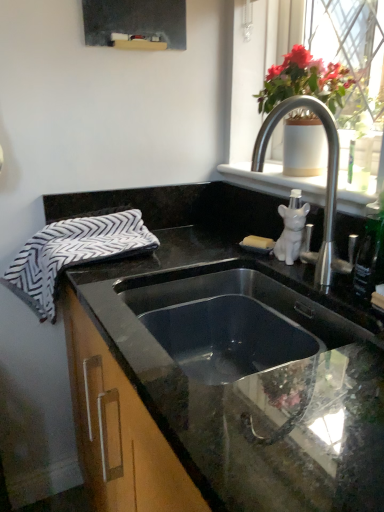
Question: Is satin nickel faucet at upper right at the left side of white ceramic dog at upper right?

Choices:
 (A) no
 (B) yes

Answer: (B)

Question: Does satin nickel faucet at upper right have a lesser width compared to white ceramic dog at upper right?

Choices:
 (A) yes
 (B) no

Answer: (B)

Question: Is satin nickel faucet at upper right wider than white ceramic dog at upper right?

Choices:
 (A) yes
 (B) no

Answer: (A)

Question: Would you say white ceramic dog at upper right is part of satin nickel faucet at upper right's contents?

Choices:
 (A) no
 (B) yes

Answer: (A)

Question: Is satin nickel faucet at upper right far from white ceramic dog at upper right?

Choices:
 (A) yes
 (B) no

Answer: (B)

Question: Is white ceramic vase at upper right to the left or to the right of white ceramic dog at upper right in the image?

Choices:
 (A) right
 (B) left

Answer: (A)

Question: In terms of height, does white ceramic vase at upper right look taller or shorter compared to white ceramic dog at upper right?

Choices:
 (A) tall
 (B) short

Answer: (A)

Question: In terms of size, does white ceramic vase at upper right appear bigger or smaller than white ceramic dog at upper right?

Choices:
 (A) big
 (B) small

Answer: (A)

Question: Which is correct: white ceramic vase at upper right is inside white ceramic dog at upper right, or outside of it?

Choices:
 (A) outside
 (B) inside

Answer: (A)

Question: Considering their positions, is black granite countertop at center located in front of or behind black and white zigzag beach towel at left?

Choices:
 (A) behind
 (B) front

Answer: (B)

Question: Considering the positions of black granite countertop at center and black and white zigzag beach towel at left in the image, is black granite countertop at center wider or thinner than black and white zigzag beach towel at left?

Choices:
 (A) thin
 (B) wide

Answer: (B)

Question: Does point (327, 389) appear closer or farther from the camera than point (107, 245)?

Choices:
 (A) farther
 (B) closer

Answer: (B)

Question: Would you say black granite countertop at center is to the left or to the right of black and white zigzag beach towel at left in the picture?

Choices:
 (A) left
 (B) right

Answer: (B)

Question: Is white ceramic vase at upper right taller or shorter than black and white zigzag beach towel at left?

Choices:
 (A) short
 (B) tall

Answer: (B)

Question: From a real-world perspective, is white ceramic vase at upper right physically located above or below black and white zigzag beach towel at left?

Choices:
 (A) above
 (B) below

Answer: (A)